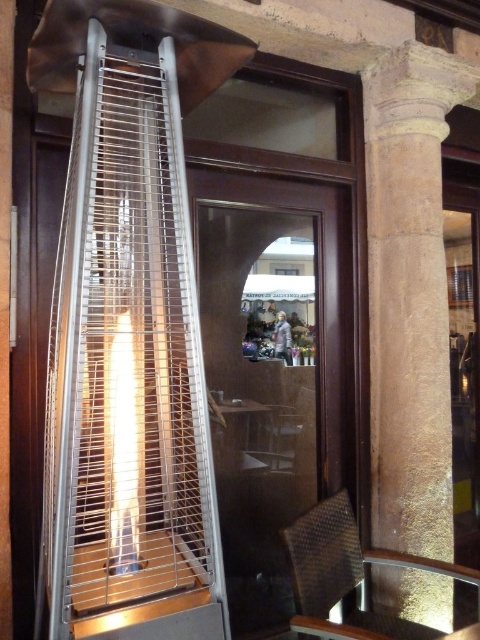
You are a delivery person trying to place a large package between the metallic wire birdcage at left and the stone column at right. The package is 4 feet wide. Can you fit it between them?

The metallic wire birdcage at left and the stone column at right are 4.31 feet apart, so the 4 feet wide package can fit between them since it is narrower than the available space.

You are standing in front of the glass door and see two points marked on the reflection. Which point, point (x=408, y=369) or point (x=303, y=602), is closer to you?

Point (x=303, y=602) is closer to you because it is in front of point (x=408, y=369).